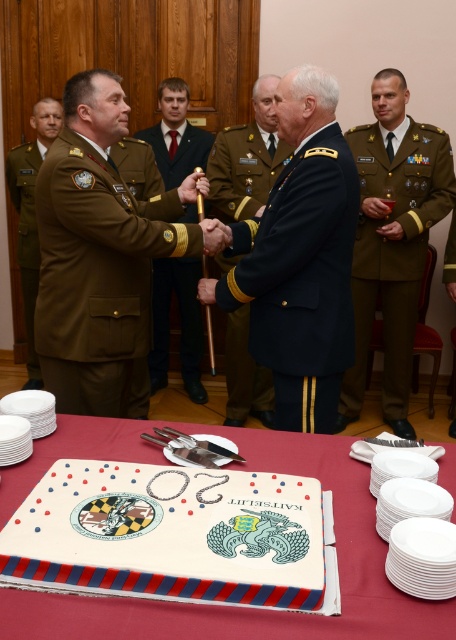
Question: Is navy blue uniform at center to the left of satin brown uniform at center from the viewer's perspective?

Choices:
 (A) yes
 (B) no

Answer: (B)

Question: Which point is farther to the camera?

Choices:
 (A) (202, 582)
 (B) (21, 248)
 (C) (139, 364)

Answer: (B)

Question: Can you confirm if dark blue fabric uniform at center is positioned to the right of olive green uniform at center?

Choices:
 (A) yes
 (B) no

Answer: (B)

Question: Based on their relative distances, which object is farther from the green fabric uniform at right?

Choices:
 (A) olive green fabric uniform at left
 (B) white frosted cake at center
 (C) satin brown uniform at center

Answer: (A)

Question: Is navy blue uniform at center smaller than green fabric uniform at right?

Choices:
 (A) no
 (B) yes

Answer: (A)

Question: Which of these objects is positioned farthest from the satin brown uniform at center?

Choices:
 (A) olive green uniform at center
 (B) dark blue fabric uniform at center
 (C) green fabric uniform at right
 (D) olive green fabric uniform at left

Answer: (B)